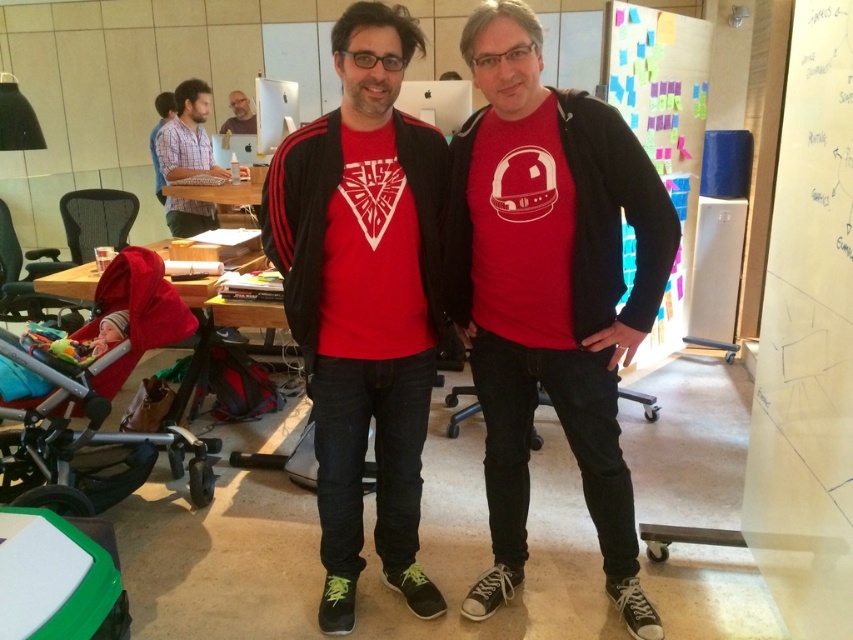
Is point (509, 192) in front of point (436, 214)?

That is True.

Is matte red t-shirt at center to the left of matte black jacket at center from the viewer's perspective?

No, matte red t-shirt at center is not to the left of matte black jacket at center.

Does point (564, 140) come behind point (375, 164)?

That is False.

The image size is (853, 640). What are the coordinates of `matte red t-shirt at center` in the screenshot? It's located at (550, 291).

Can you confirm if matte red t-shirt at center is thinner than matte blue shirt at upper left?

Yes.

Between point (497, 380) and point (195, 92), which one is positioned in front?

Point (497, 380) is in front.

In order to click on matte red t-shirt at center in this screenshot , I will do `click(550, 291)`.

Is matte black jacket at center wider than matte black laptop at upper left?

Yes, matte black jacket at center is wider than matte black laptop at upper left.

Can you confirm if matte black jacket at center is thinner than matte black laptop at upper left?

No, matte black jacket at center is not thinner than matte black laptop at upper left.

The image size is (853, 640). Describe the element at coordinates (364, 298) in the screenshot. I see `matte black jacket at center` at that location.

The height and width of the screenshot is (640, 853). Identify the location of matte black jacket at center. (364, 298).